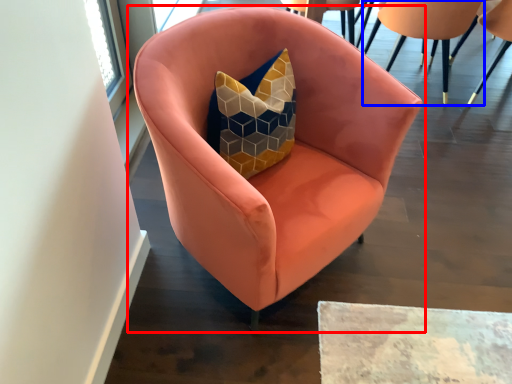
Question: Among these objects, which one is nearest to the camera, chair (highlighted by a red box) or chair (highlighted by a blue box)?

Choices:
 (A) chair
 (B) chair

Answer: (A)